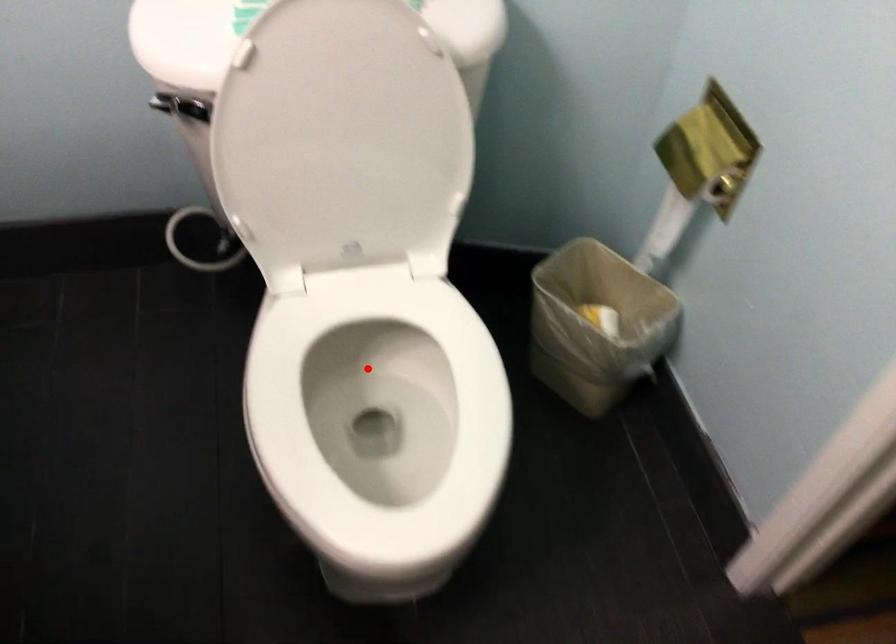
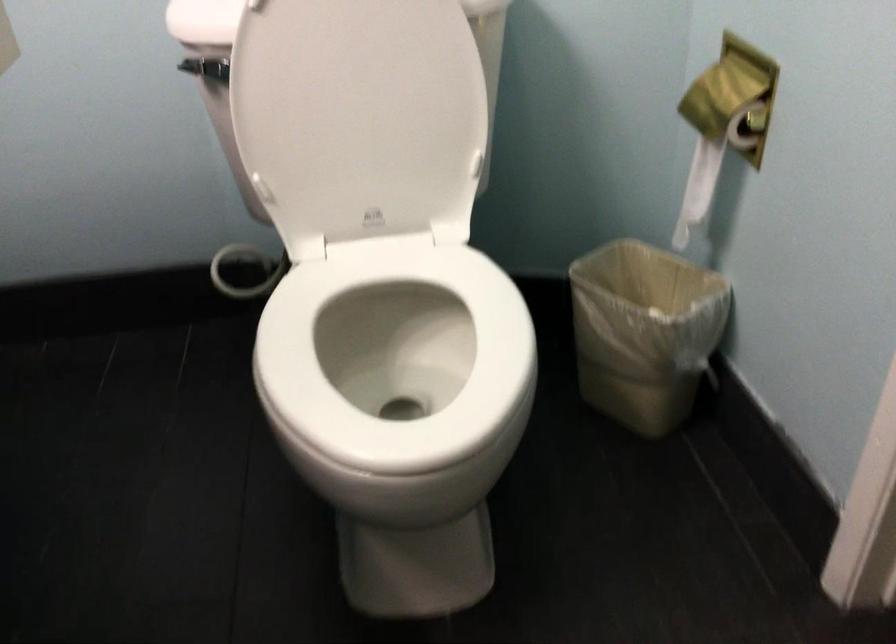
Find the pixel in the second image that matches the highlighted location in the first image.

(395, 359)